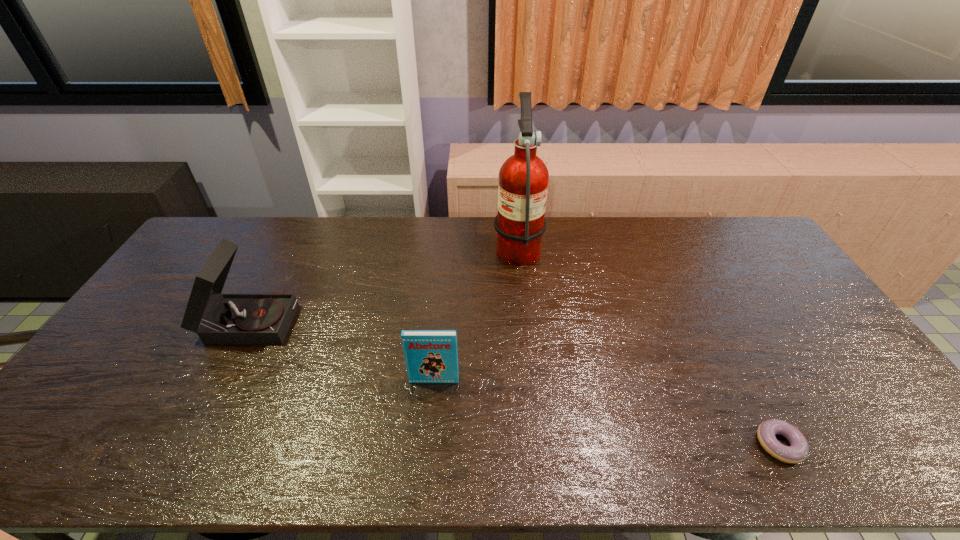
Image resolution: width=960 pixels, height=540 pixels. In order to click on free space that is in between the book and the shortest object in this screenshot , I will do `click(607, 413)`.

Where is `object that is the second nearest to the phonograph_record`? object that is the second nearest to the phonograph_record is located at coordinates (523, 178).

Where is `the second closest object to the leftmost object`? Image resolution: width=960 pixels, height=540 pixels. the second closest object to the leftmost object is located at coordinates (523, 178).

Find the location of a particular element. vacant space that satisfies the following two spatial constraints: 1. on the nozzle and handle of the farthest object; 2. on the right side of the rightmost object is located at coordinates (538, 444).

The width and height of the screenshot is (960, 540). Identify the location of free point that satisfies the following two spatial constraints: 1. on the front cover of the book; 2. on the left side of the nearest object. (428, 444).

You are a GUI agent. You are given a task and a screenshot of the screen. Output one action in this format:
    pyautogui.click(x=<x>, y=<y>)
    Task: Click on the free point that satisfies the following two spatial constraints: 1. on the back side of the doughnut; 2. on the nozzle and handle of the tallest object
    The height and width of the screenshot is (540, 960).
    Given the screenshot: What is the action you would take?
    pyautogui.click(x=674, y=246)

Identify the location of free location that satisfies the following two spatial constraints: 1. on the nozzle and handle of the tallest object; 2. on the back side of the rightmost object. This screenshot has width=960, height=540. (538, 444).

The width and height of the screenshot is (960, 540). I want to click on free space that satisfies the following two spatial constraints: 1. on the front cover of the rightmost object; 2. on the right side of the third object from right to left, so click(428, 444).

The width and height of the screenshot is (960, 540). I want to click on vacant space that satisfies the following two spatial constraints: 1. on the front-facing side of the nearest object; 2. on the left side of the phonograph_record, so click(x=185, y=444).

Identify the location of free space that satisfies the following two spatial constraints: 1. on the nozzle and handle of the farthest object; 2. on the front cover of the third object from right to left. (x=531, y=381).